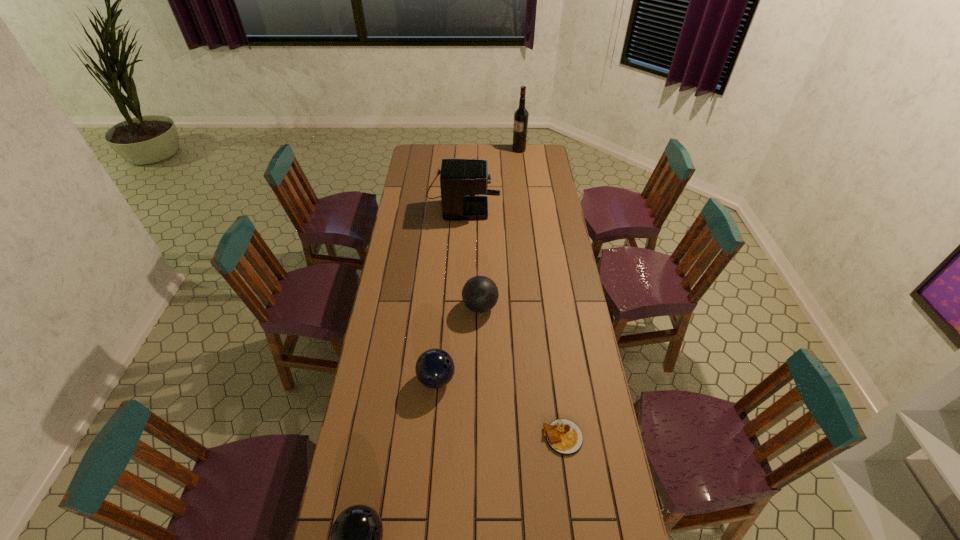
This screenshot has width=960, height=540. In order to click on vacant space situated 0.200m on the front and back of the tallest object in this screenshot , I will do `click(480, 150)`.

At what (x,y) coordinates should I click in order to perform the action: click on vacant region located on the front and back of the tallest object. Please return your answer as a coordinate pair (x, y). Image resolution: width=960 pixels, height=540 pixels. Looking at the image, I should click on (499, 150).

The image size is (960, 540). I want to click on vacant space located on the front and back of the tallest object, so click(x=462, y=150).

The image size is (960, 540). In order to click on free space located 0.280m on the front-facing side of the second tallest object in this screenshot , I will do `click(550, 194)`.

Locate an element on the screen. This screenshot has height=540, width=960. vacant space situated on the grip area of the farthest bowling ball is located at coordinates (441, 306).

You are a GUI agent. You are given a task and a screenshot of the screen. Output one action in this format:
    pyautogui.click(x=<x>, y=<y>)
    Task: Click on the vacant space located on the grip area of the farthest bowling ball
    This screenshot has height=540, width=960.
    Given the screenshot: What is the action you would take?
    (415, 306)

Locate an element on the screen. blank space located 0.110m on the grip area of the farthest bowling ball is located at coordinates (436, 306).

Locate an element on the screen. Image resolution: width=960 pixels, height=540 pixels. free space located 0.350m on the surface of the second bowling ball from left to right near the finger holes is located at coordinates (551, 379).

This screenshot has height=540, width=960. Find the location of `free space located on the back of the omelet`. free space located on the back of the omelet is located at coordinates (550, 345).

Locate an element on the screen. This screenshot has height=540, width=960. object positioned at the far edge is located at coordinates (521, 115).